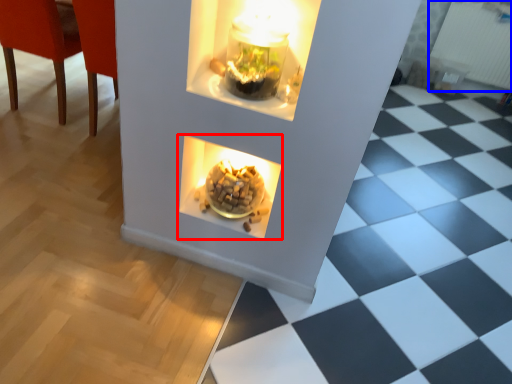
Question: Which object is further to the camera taking this photo, fireplace (highlighted by a red box) or radiator (highlighted by a blue box)?

Choices:
 (A) fireplace
 (B) radiator

Answer: (B)